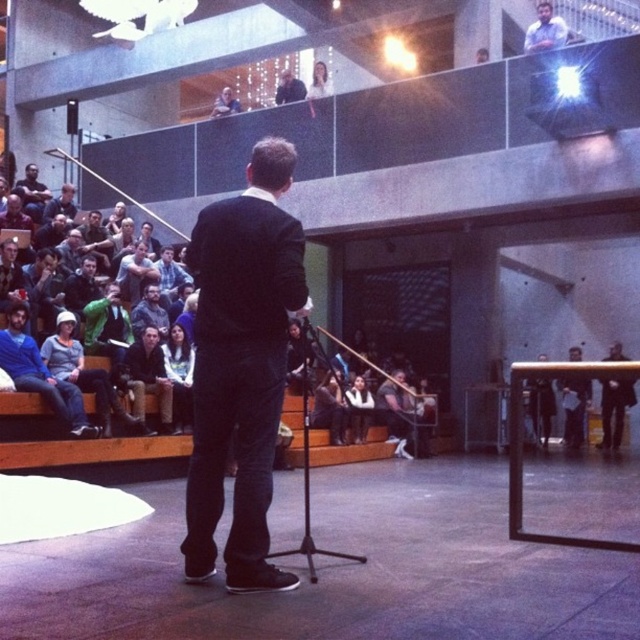
Between black matte suit at center and light blue shirt at upper right, which one has less height?

Standing shorter between the two is light blue shirt at upper right.

Describe the element at coordinates (241, 365) in the screenshot. The height and width of the screenshot is (640, 640). I see `black matte suit at center` at that location.

What are the coordinates of `black matte suit at center` in the screenshot? It's located at (241, 365).

The width and height of the screenshot is (640, 640). What do you see at coordinates (241, 365) in the screenshot?
I see `black matte suit at center` at bounding box center [241, 365].

Who is positioned more to the left, black matte suit at center or dark blue suit at upper center?

dark blue suit at upper center

Where is `black matte suit at center`? The height and width of the screenshot is (640, 640). black matte suit at center is located at coordinates (241, 365).

Find the location of a particular element. The image size is (640, 640). black matte suit at center is located at coordinates (241, 365).

Is dark gray fabric seats at left above dark blue jeans at center?

No, dark gray fabric seats at left is not above dark blue jeans at center.

Is dark gray fabric seats at left behind dark blue jeans at center?

No, it is in front of dark blue jeans at center.

At what (x,y) coordinates should I click in order to perform the action: click on dark gray fabric seats at left. Please return your answer as a coordinate pair (x, y). Looking at the image, I should click on (88, 451).

Where is `dark gray fabric seats at left`? dark gray fabric seats at left is located at coordinates (88, 451).